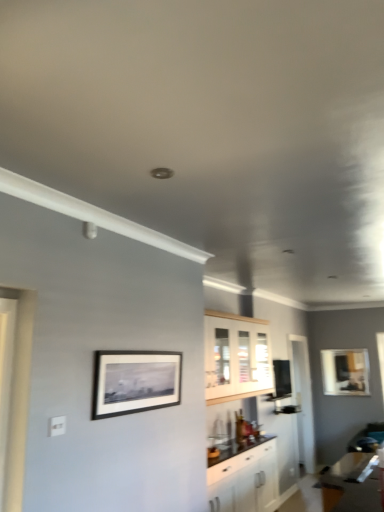
Question: From a real-world perspective, is transparent glass door at center positioned above or below black matte picture frame at upper center, the second picture frame from the back?

Choices:
 (A) below
 (B) above

Answer: (A)

Question: Considering the relative positions of transparent glass door at center and black matte picture frame at upper center, the first picture frame positioned from the top, in the image provided, is transparent glass door at center to the left or to the right of black matte picture frame at upper center, the first picture frame positioned from the top,?

Choices:
 (A) right
 (B) left

Answer: (A)

Question: Which of these objects is positioned farthest from the transparent glass door at center?

Choices:
 (A) white glossy cabinet at center, acting as the second cabinetry starting from the top
 (B) matte black picture frame at upper right, which appears as the 1th picture frame when viewed from the right
 (C) black matte picture frame at upper center, the second picture frame in the bottom-to-top sequence
 (D) white wood cabinet at center, positioned as the 2th cabinetry in bottom-to-top order

Answer: (C)

Question: Which of these objects is positioned farthest from the white glossy cabinet at center, the 1th cabinetry from the bottom?

Choices:
 (A) white wood cabinet at center, positioned as the 2th cabinetry in bottom-to-top order
 (B) transparent glass door at center
 (C) matte black picture frame at upper right, acting as the 2th picture frame starting from the left
 (D) black matte picture frame at upper center, the first picture frame positioned from the top

Answer: (C)